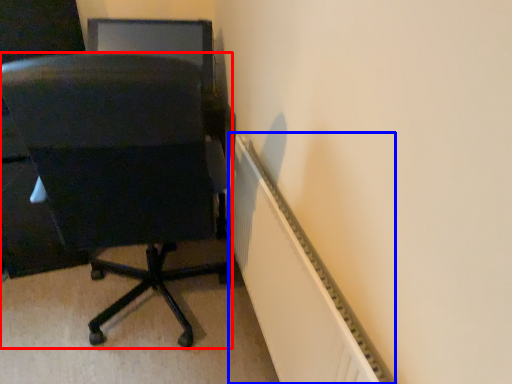
Question: Among these objects, which one is farthest to the camera, chair (highlighted by a red box) or radiator (highlighted by a blue box)?

Choices:
 (A) chair
 (B) radiator

Answer: (A)